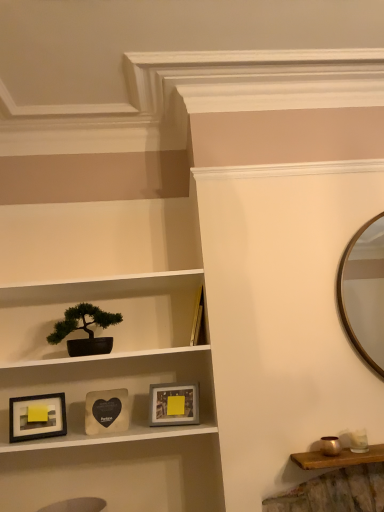
Question: In terms of height, does matte black pot at center look taller or shorter compared to matte black picture frame at lower left, arranged as the 3th picture frame when viewed from the right?

Choices:
 (A) tall
 (B) short

Answer: (A)

Question: From the image's perspective, relative to matte black picture frame at lower left, arranged as the 3th picture frame when viewed from the right, is matte black pot at center above or below?

Choices:
 (A) below
 (B) above

Answer: (B)

Question: Estimate the real-world distances between objects in this image. Which object is farther from the matte gray frame at center, which ranks as the first picture frame in right-to-left order?

Choices:
 (A) green matte bonsai tree at left
 (B) matte black picture frame at lower left, arranged as the 3th picture frame when viewed from the right
 (C) matte black pot at center
 (D) wooden heart-shaped picture frame at center, placed as the 2th picture frame when sorted from right to left

Answer: (B)

Question: Considering the real-world distances, which object is closest to the green matte bonsai tree at left?

Choices:
 (A) wooden heart-shaped picture frame at center, the second picture frame from the left
 (B) matte black pot at center
 (C) matte gray frame at center, which ranks as the first picture frame in right-to-left order
 (D) matte black picture frame at lower left, positioned as the 1th picture frame in left-to-right order

Answer: (B)